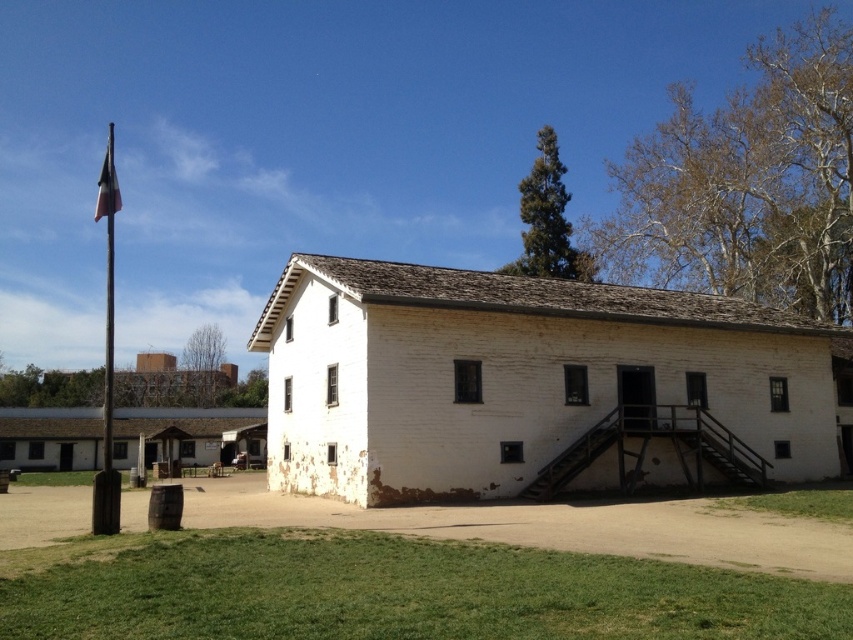
You are standing at the entrance of the historic building and want to walk to the wooden flag pole at left. Which direction should you head towards?

The wooden flag pole at left is located to your left side, so you should head towards the left direction from the entrance to reach it.

Based on the photo, you are standing on the dirt path in front of the historic building. You want to walk towards the wooden flag pole at left and the blue fabric flag at upper left. Which object will you reach first?

The wooden flag pole at left is closer to the viewer than the blue fabric flag at upper left, so you will reach the wooden flag pole at left first.